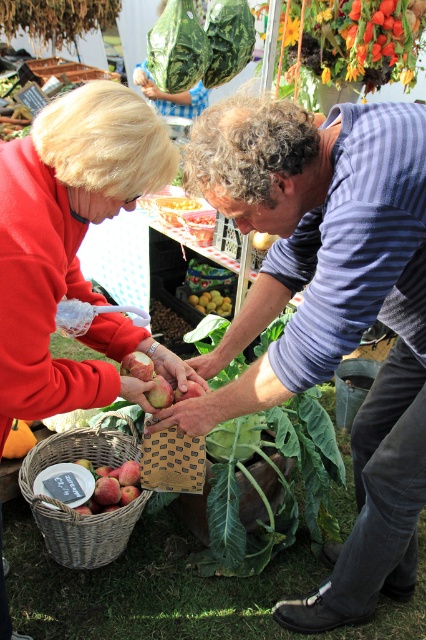
You are a customer at the market and want to pick up the red matte apple at lower left. Is the green leafy vegetable at center blocking your access to it?

The green leafy vegetable at center is positioned over the red matte apple at lower left, so it is blocking access to the apple.